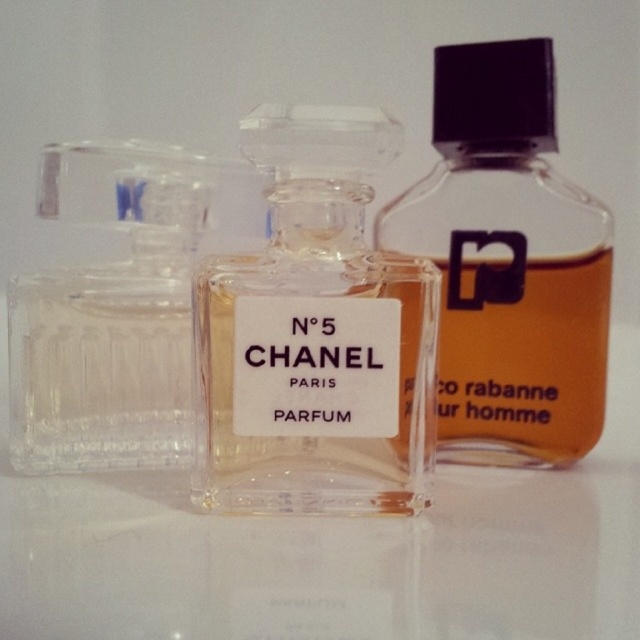
Between transparent glass bottle at center and transparent glass perfume at left, which one is positioned higher?

Positioned higher is transparent glass bottle at center.

Is point (483, 417) less distant than point (83, 195)?

No, (483, 417) is further to viewer.

Measure the distance between point [516,364] and camera.

Point [516,364] and camera are 32.52 inches apart from each other.

Where is `transparent glass bottle at center`? The width and height of the screenshot is (640, 640). transparent glass bottle at center is located at coordinates (508, 262).

Can you confirm if clear glass bottle at center is thinner than transparent glass bottle at center?

Correct, clear glass bottle at center's width is less than transparent glass bottle at center's.

You are a GUI agent. You are given a task and a screenshot of the screen. Output one action in this format:
    pyautogui.click(x=<x>, y=<y>)
    Task: Click on the clear glass bottle at center
    Image resolution: width=640 pixels, height=640 pixels.
    Given the screenshot: What is the action you would take?
    pyautogui.click(x=316, y=333)

Does point (378, 374) come farther from viewer compared to point (563, 250)?

No, (378, 374) is in front of (563, 250).

The height and width of the screenshot is (640, 640). I want to click on clear glass bottle at center, so click(316, 333).

Can you confirm if clear glass bottle at center is wider than transparent glass perfume at left?

Indeed, clear glass bottle at center has a greater width compared to transparent glass perfume at left.

The image size is (640, 640). Find the location of `clear glass bottle at center`. clear glass bottle at center is located at coordinates (316, 333).